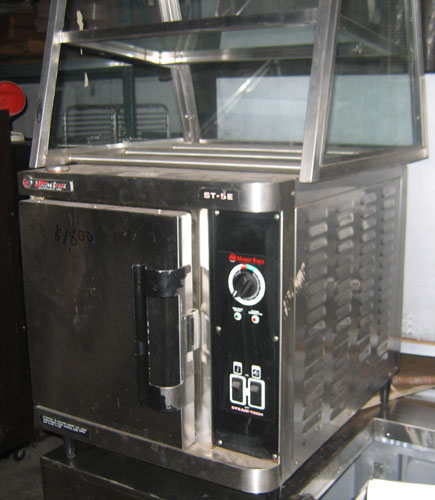
Where is `metal door`? metal door is located at coordinates click(91, 333).